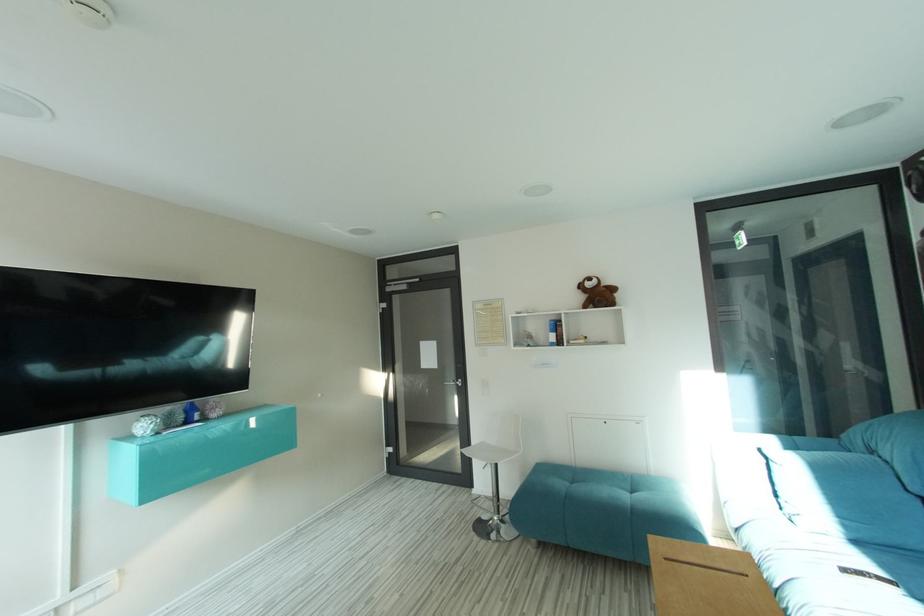
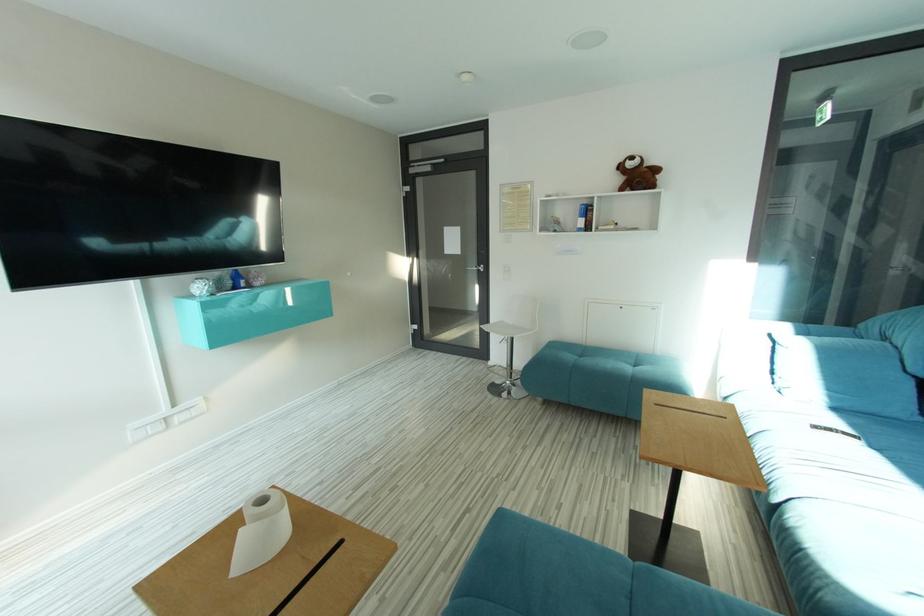
Question: The images are taken continuously from a first-person perspective. In which direction are you moving?

Choices:
 (A) Left
 (B) Right
 (C) Forward
 (D) Backward

Answer: (D)